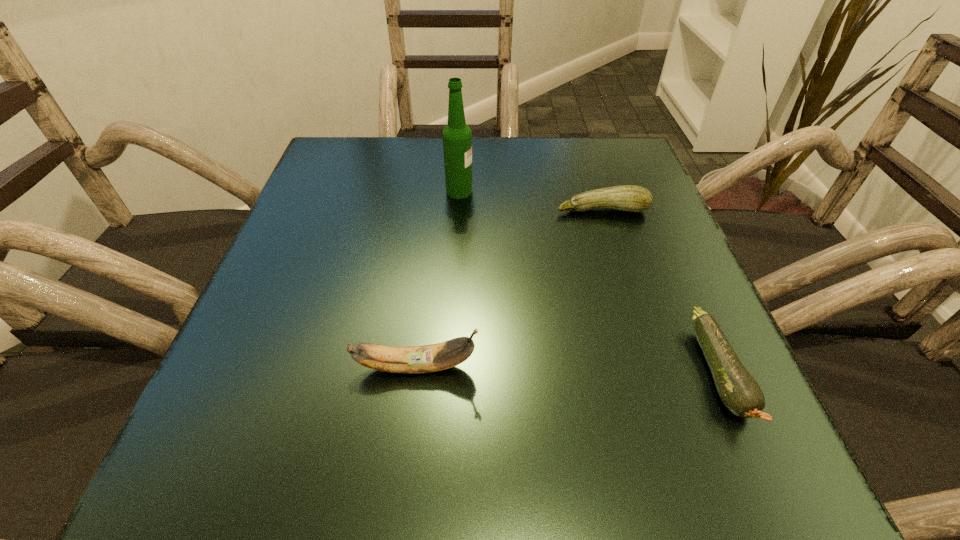
You are a GUI agent. You are given a task and a screenshot of the screen. Output one action in this format:
    pyautogui.click(x=<x>, y=<y>)
    Task: Click on the object that can be found as the closest to the nearer zucchini
    
    Given the screenshot: What is the action you would take?
    pyautogui.click(x=631, y=198)